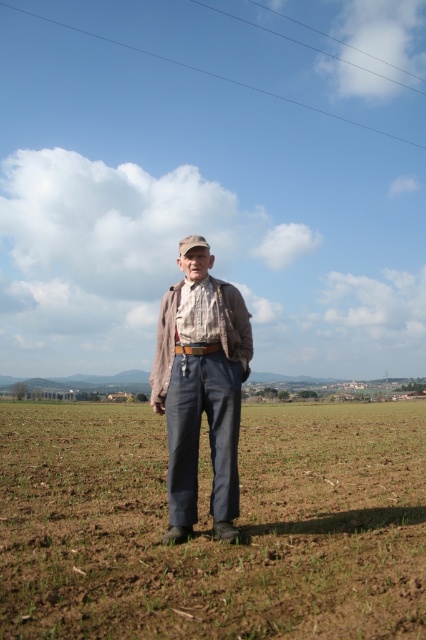
Question: Which point is farther to the camera?

Choices:
 (A) dull gray fabric at center
 (B) plaid fabric shirt at center

Answer: (B)

Question: Can you confirm if dull gray fabric at center is bigger than plaid fabric shirt at center?

Choices:
 (A) no
 (B) yes

Answer: (B)

Question: Observing the image, what is the correct spatial positioning of dull gray fabric at center in reference to plaid fabric shirt at center?

Choices:
 (A) right
 (B) left

Answer: (A)

Question: Among these objects, which one is nearest to the camera?

Choices:
 (A) plaid fabric shirt at center
 (B) dull gray fabric at center

Answer: (B)

Question: Does dull gray fabric at center appear on the left side of plaid fabric shirt at center?

Choices:
 (A) no
 (B) yes

Answer: (A)